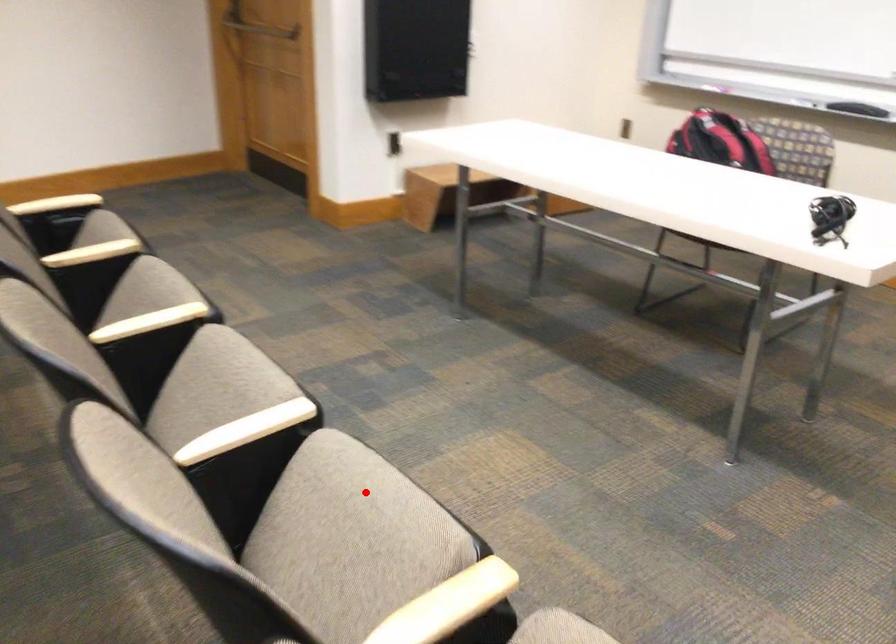
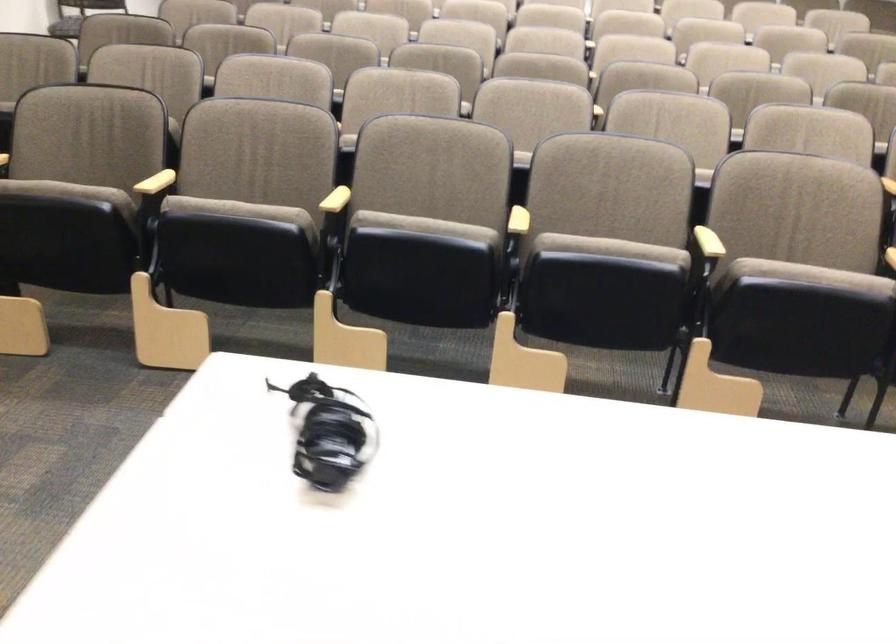
Question: I am providing you with two images of the same scene from different viewpoints. Image1 has a red point marked. In image2, the corresponding 3D location appears at what relative position? Reply with the corresponding letter.

Choices:
 (A) Closer
 (B) Farther

Answer: (B)